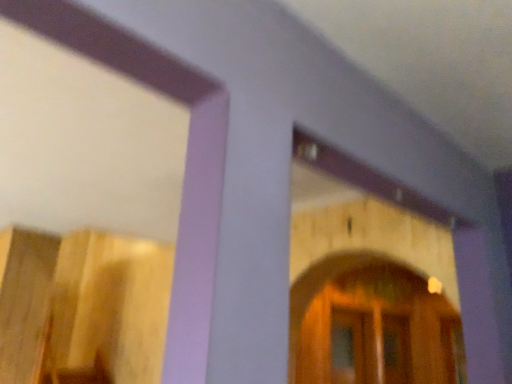
This screenshot has height=384, width=512. What do you see at coordinates (371, 325) in the screenshot?
I see `wooden door at center` at bounding box center [371, 325].

This screenshot has width=512, height=384. I want to click on wooden door at center, so click(371, 325).

Locate an element on the screen. The height and width of the screenshot is (384, 512). wooden door at center is located at coordinates (371, 325).